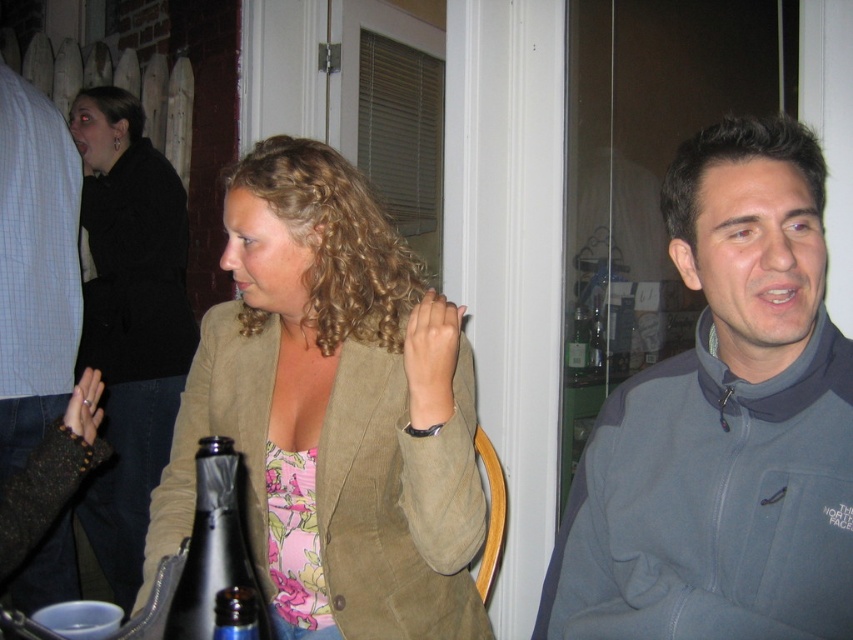
You are at a party and want to grab the clear glass bottle at center without touching the light blue plaid shirt at left. Is it possible?

The light blue plaid shirt at left is positioned under the clear glass bottle at center, so you can reach the clear glass bottle at center without touching the light blue plaid shirt at left since it is above it.